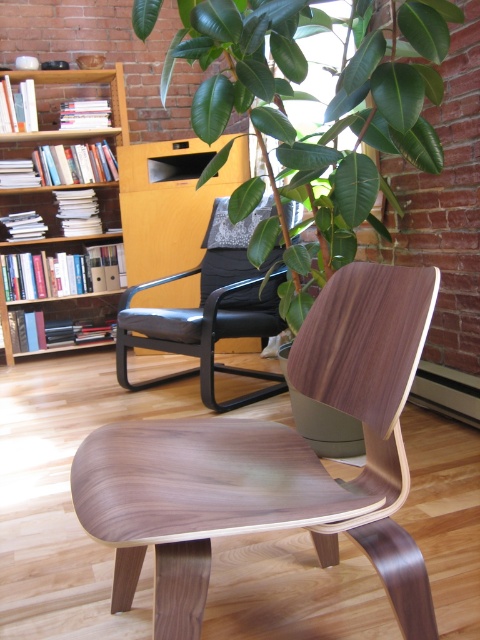
You are a visitor entering the room and want to place a new tall potted plant in the corner near the wooden bookshelf at left. However, you notice the green leafy plant at upper center already occupies that space. Can you place your new plant there without removing the existing one?

The green leafy plant at upper center is much taller than the wooden bookshelf at left, so placing another tall plant in the same area might not be feasible due to limited space and potential overcrowding.

You are standing in the room and see two points marked in the image. The first point is at coordinate point (x=277, y=493) and the second at point (x=436, y=166). Which point is closer to you?

Point (x=277, y=493) is in front of point (x=436, y=166), so it is closer to you.

You are standing in a room and see a point marked at coordinate (330, 372). If you move 2 feet closer to this point, will you be closer to the wooden chair in the foreground than the bookshelf in the background?

The distance of point (330, 372) from camera is 3.91 feet. Moving 2 feet closer would bring you to 1.91 feet from the point. Since the wooden chair is in the foreground and the bookshelf is in the background, the wooden chair is closer to you than the bookshelf. Therefore, you would be closer to the wooden chair in the foreground.